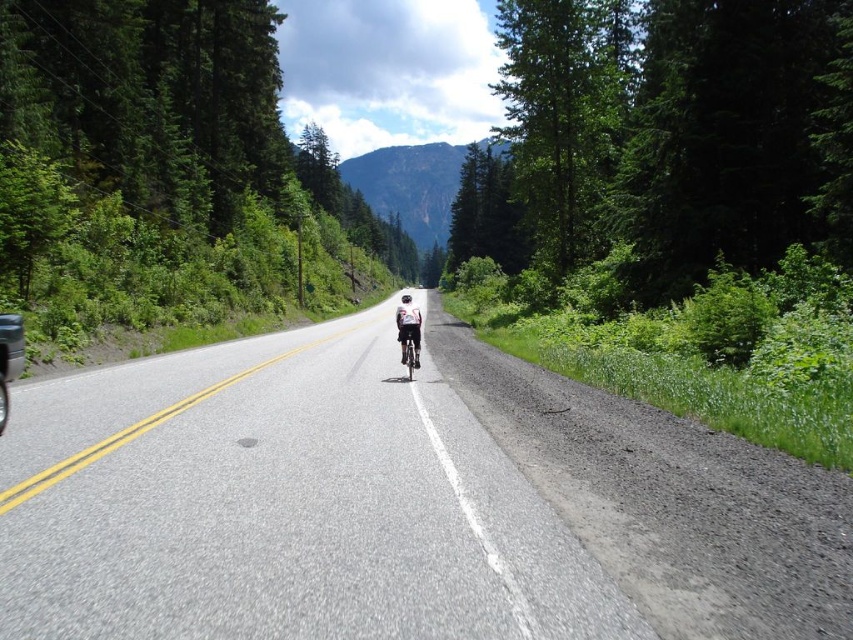
You are standing on the side of the road and see the cyclist at point (699, 531). Can you safely throw a small pebble to reach them without crossing the road?

The cyclist at point (699, 531) is 5.65 meters away from you. Since the road is between you and the cyclist, you would need to cross the road to throw the pebble, which is not safe. Therefore, it is not advisable to attempt this.

You are a pedestrian standing at the side of the road and see the white fabric cyclist at center and the shiny silver bicycle at center. Which one appears bigger in the image?

The white fabric cyclist at center appears larger in size than the shiny silver bicycle at center.